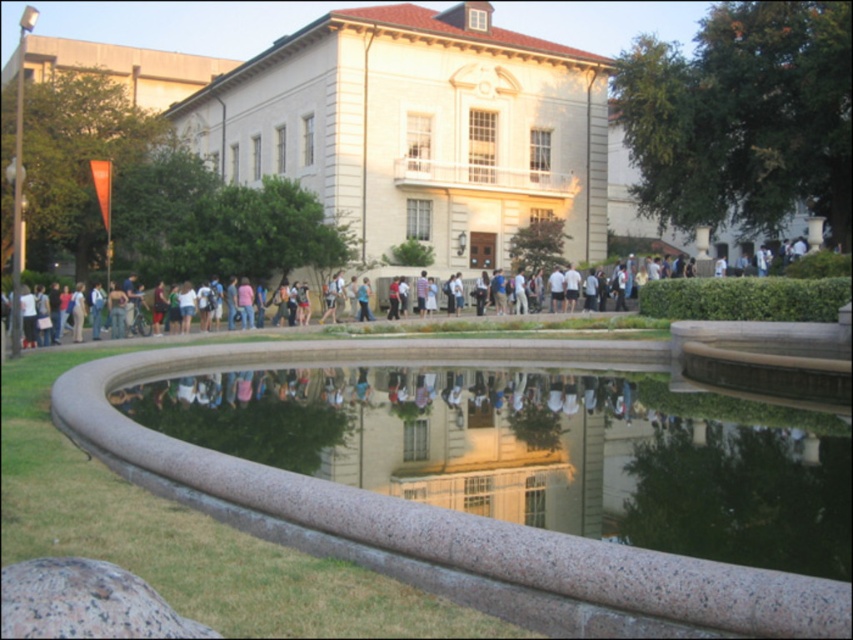
Between white stone building at center and granite fountain at lower center, which one appears on the right side from the viewer's perspective?

From the viewer's perspective, granite fountain at lower center appears more on the right side.

Does point (404, 157) come in front of point (267, 499)?

No, (404, 157) is further to viewer.

Identify the location of white stone building at center. This screenshot has height=640, width=853. (419, 129).